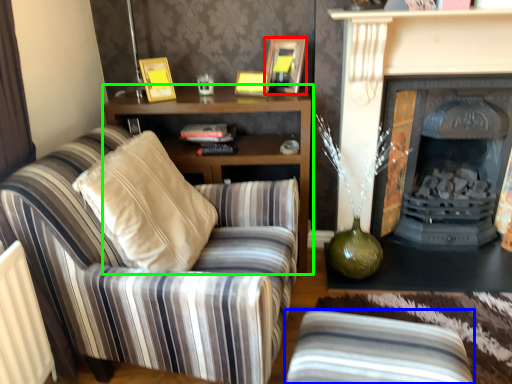
Question: Based on their relative distances, which object is nearer to picture frame (highlighted by a red box)? Choose from studio couch (highlighted by a blue box) and cabinetry (highlighted by a green box).

Choices:
 (A) studio couch
 (B) cabinetry

Answer: (B)